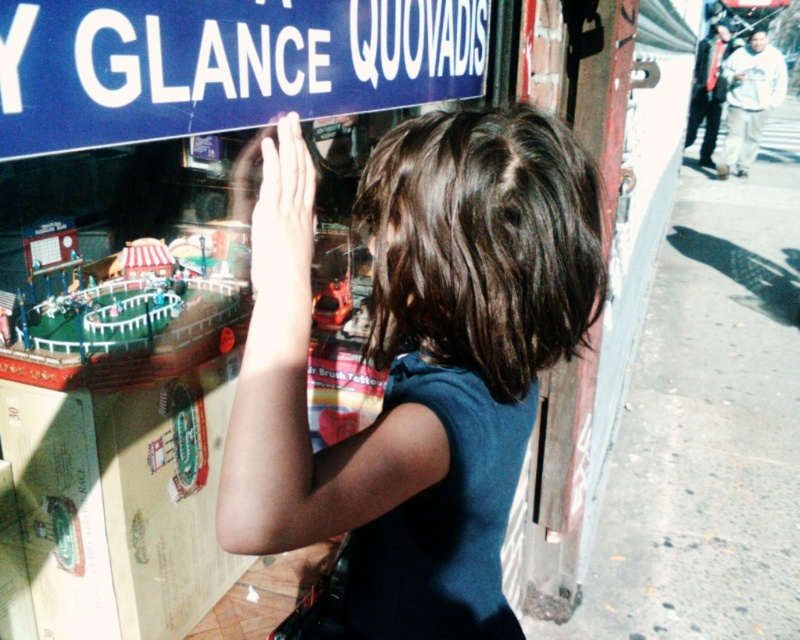
Question: Among these objects, which one is farthest from the camera?

Choices:
 (A) blue plastic sign at upper center
 (B) dark blue fabric at center

Answer: (B)

Question: Can you confirm if dark blue fabric at center is positioned to the left of blue plastic sign at upper center?

Choices:
 (A) no
 (B) yes

Answer: (A)

Question: Is dark blue fabric at center to the left of blue plastic sign at upper center from the viewer's perspective?

Choices:
 (A) no
 (B) yes

Answer: (A)

Question: Does dark blue fabric at center have a greater width compared to blue plastic sign at upper center?

Choices:
 (A) yes
 (B) no

Answer: (B)